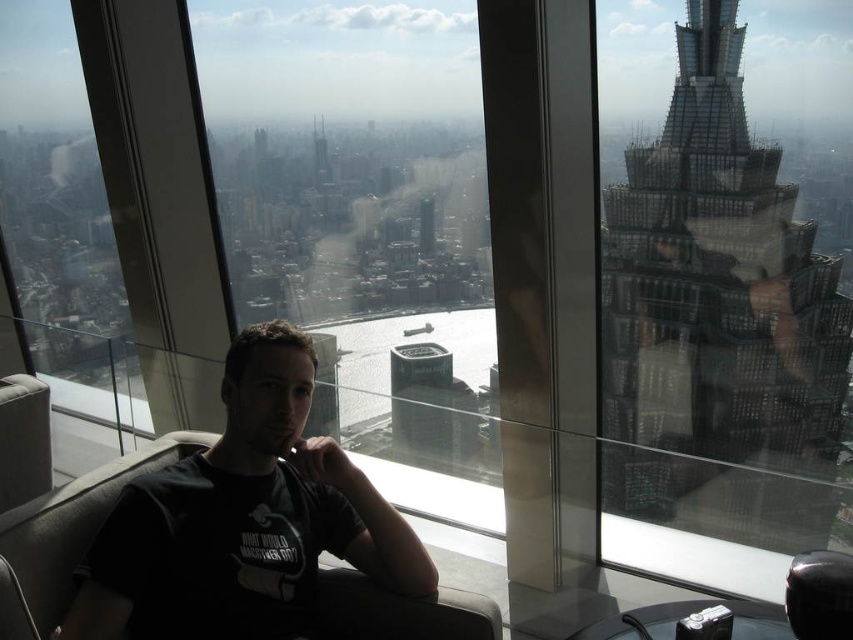
Is transparent glass window at right above black matte shirt at center?

Yes, transparent glass window at right is above black matte shirt at center.

Which is in front, point (780, 113) or point (294, 444)?

Point (294, 444) is in front.

Between point (628, 401) and point (149, 529), which one is positioned behind?

The point (628, 401) is behind.

The width and height of the screenshot is (853, 640). Find the location of `transparent glass window at right`. transparent glass window at right is located at coordinates (724, 291).

Looking at this image, does transparent glass window at right appear on the right side of transparent glass window at center?

Yes, transparent glass window at right is to the right of transparent glass window at center.

From the picture: How much distance is there between transparent glass window at right and transparent glass window at center?

The distance of transparent glass window at right from transparent glass window at center is 635.87 feet.

This screenshot has height=640, width=853. I want to click on transparent glass window at right, so click(724, 291).

You are a GUI agent. You are given a task and a screenshot of the screen. Output one action in this format:
    pyautogui.click(x=<x>, y=<y>)
    Task: Click on the transparent glass window at right
    This screenshot has height=640, width=853.
    Given the screenshot: What is the action you would take?
    [724, 291]

Is transparent glass window at center smaller than black matte shirt at center?

Yes, transparent glass window at center is smaller than black matte shirt at center.

The width and height of the screenshot is (853, 640). Identify the location of transparent glass window at center. (366, 227).